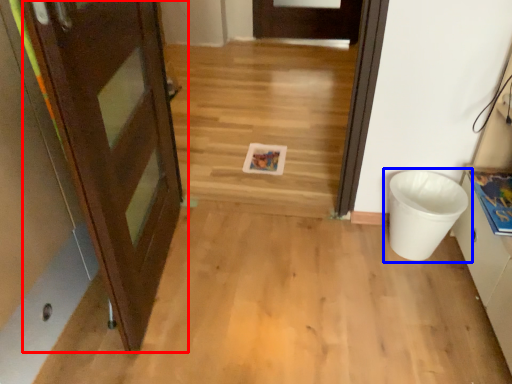
Question: Which object appears closest to the camera in this image, door (highlighted by a red box) or waste container (highlighted by a blue box)?

Choices:
 (A) door
 (B) waste container

Answer: (A)